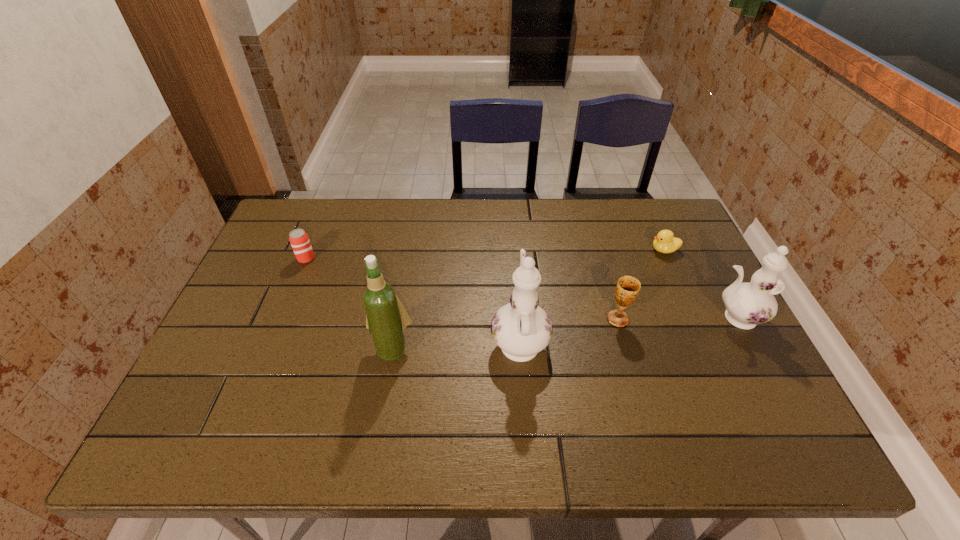
At what (x,y) coordinates should I click in order to perform the action: click on the taller chinaware. Please return your answer as a coordinate pair (x, y). The height and width of the screenshot is (540, 960). Looking at the image, I should click on (521, 328).

What are the coordinates of `the left chinaware` in the screenshot? It's located at (521, 328).

Locate an element on the screen. The height and width of the screenshot is (540, 960). the third tallest object is located at coordinates pyautogui.click(x=747, y=304).

Locate an element on the screen. the right chinaware is located at coordinates (747, 304).

Image resolution: width=960 pixels, height=540 pixels. I want to click on duckling, so click(665, 242).

Locate an element on the screen. Image resolution: width=960 pixels, height=540 pixels. wine bottle is located at coordinates (386, 318).

Find the location of a particular element. The image size is (960, 540). chalice is located at coordinates (628, 287).

Locate an element on the screen. the fourth tallest object is located at coordinates (628, 287).

Locate an element on the screen. Image resolution: width=960 pixels, height=540 pixels. the leftmost object is located at coordinates (299, 240).

Where is `beer can`? beer can is located at coordinates (299, 240).